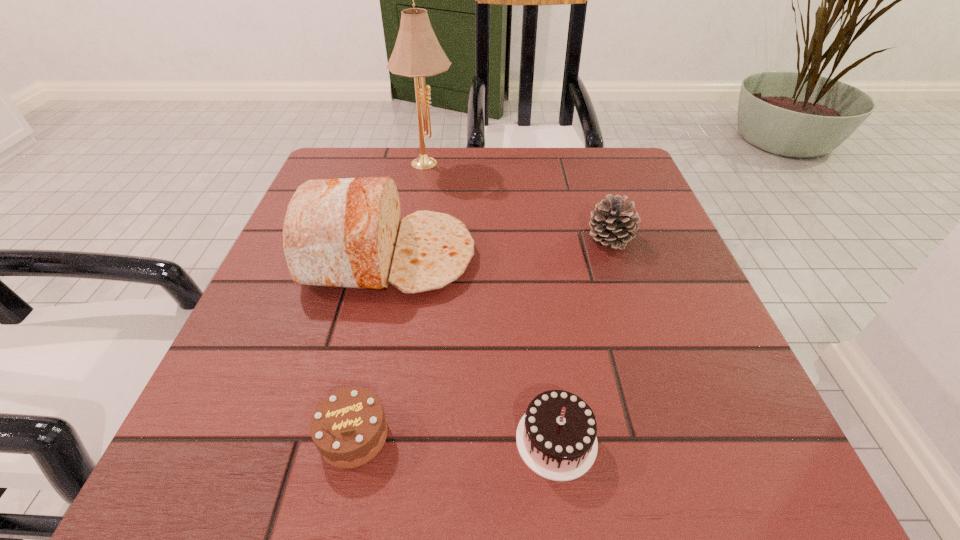
Find the location of a particular element. Image resolution: width=960 pixels, height=540 pixels. vacant space that is in between the shortest object and the pinecone is located at coordinates (482, 337).

The height and width of the screenshot is (540, 960). What are the coordinates of `empty space that is in between the shorter chocolate cake and the taller chocolate cake` in the screenshot? It's located at (455, 438).

At what (x,y) coordinates should I click in order to perform the action: click on empty location between the bread and the shorter chocolate cake. Please return your answer as a coordinate pair (x, y). The width and height of the screenshot is (960, 540). Looking at the image, I should click on (372, 346).

What are the coordinates of `object identified as the fourth closest to the taller chocolate cake` in the screenshot? It's located at (417, 53).

Point out which object is positioned as the nearest to the shorter chocolate cake. Please provide its 2D coordinates. Your answer should be formatted as a tuple, i.e. [(x, y)], where the tuple contains the x and y coordinates of a point satisfying the conditions above.

[(556, 438)]

What are the coordinates of `free space that satisfies the following two spatial constraints: 1. at the sliced end of the taller chocolate cake; 2. on the right side of the bread` in the screenshot? It's located at (348, 440).

The height and width of the screenshot is (540, 960). Identify the location of free spot that satisfies the following two spatial constraints: 1. at the sliced end of the left chocolate cake; 2. on the left side of the bread. coord(348,435).

This screenshot has width=960, height=540. I want to click on blank space that satisfies the following two spatial constraints: 1. on the front side of the third shortest object; 2. at the sliced end of the second tallest object, so click(x=615, y=256).

Locate an element on the screen. free space that satisfies the following two spatial constraints: 1. at the sliced end of the taller chocolate cake; 2. on the right side of the bread is located at coordinates (348, 440).